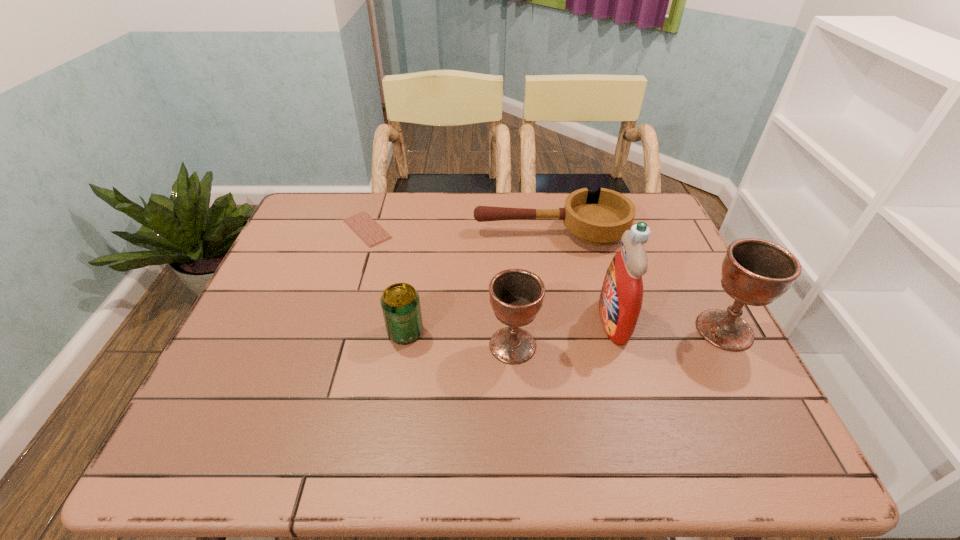
The width and height of the screenshot is (960, 540). In the image, there is a desktop. Identify the location of blank space at the far left corner. (314, 226).

Where is `free space at the near right corner of the desktop`? This screenshot has width=960, height=540. free space at the near right corner of the desktop is located at coordinates (723, 407).

The image size is (960, 540). What are the coordinates of `unoccupied area between the leftmost object and the fourth tallest object` in the screenshot? It's located at (386, 281).

I want to click on unoccupied area between the chocolate bar and the shorter chalice, so click(440, 287).

The height and width of the screenshot is (540, 960). I want to click on empty space that is in between the leftmost object and the tallest object, so click(491, 275).

The width and height of the screenshot is (960, 540). I want to click on free point between the tallest object and the saucepan, so click(x=582, y=276).

Identify the location of vacant area that lies between the detergent and the right chalice. This screenshot has height=540, width=960. (669, 326).

Where is `vacant space in between the detergent and the saucepan`? This screenshot has height=540, width=960. vacant space in between the detergent and the saucepan is located at coordinates (582, 276).

The image size is (960, 540). What are the coordinates of `free area in between the third tallest object and the fifth object from right to left` in the screenshot? It's located at coord(459,339).

This screenshot has height=540, width=960. In order to click on free point between the third shortest object and the right chalice in this screenshot , I will do `click(564, 331)`.